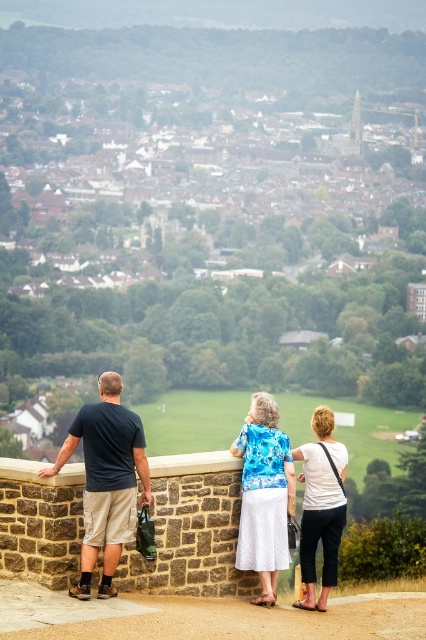
Question: Does dark blue t-shirt at left appear over white cotton shirt at center?

Choices:
 (A) no
 (B) yes

Answer: (B)

Question: Which object is closer to the camera taking this photo?

Choices:
 (A) blue floral blouse at center
 (B) white cotton shirt at center

Answer: (A)

Question: Which point is closer to the camera?

Choices:
 (A) (253, 440)
 (B) (333, 532)
 (C) (97, 404)

Answer: (C)

Question: Can you confirm if blue floral blouse at center is smaller than white cotton shirt at center?

Choices:
 (A) yes
 (B) no

Answer: (A)

Question: Which object appears farthest from the camera in this image?

Choices:
 (A) white cotton shirt at center
 (B) blue floral blouse at center
 (C) dark blue t-shirt at left

Answer: (A)

Question: Is dark blue t-shirt at left further to the viewer compared to white cotton shirt at center?

Choices:
 (A) yes
 (B) no

Answer: (B)